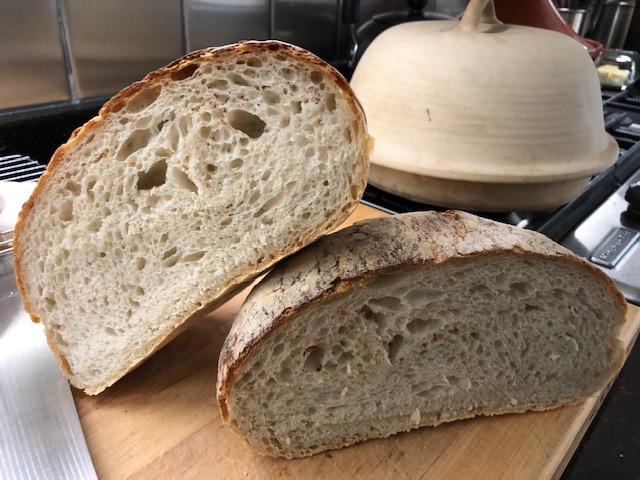
Find the location of `edge of table`. edge of table is located at coordinates (634, 312).